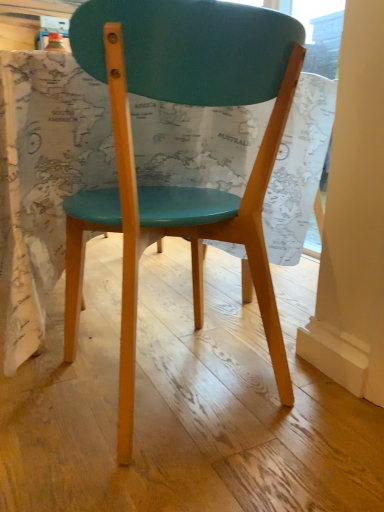
Identify the location of vacant space in front of teal matte wood chair at center. This screenshot has width=384, height=512. (184, 477).